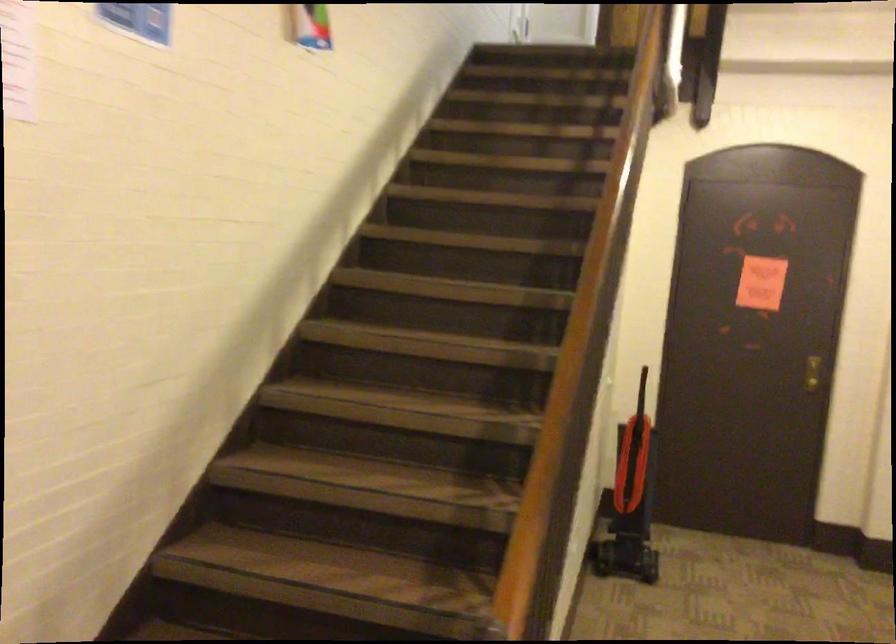
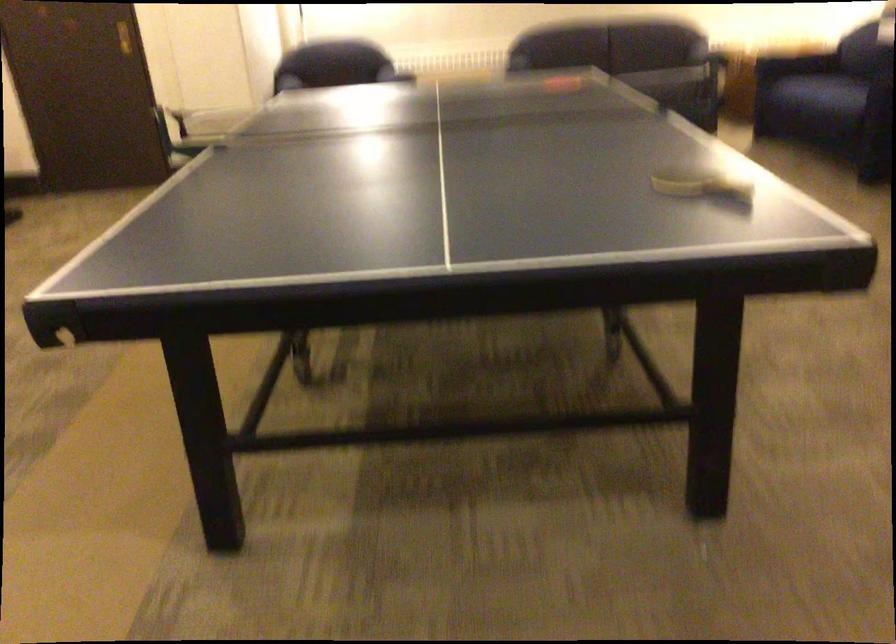
What movement of the cameraman would produce the second image?

The cameraman walked toward right, backward.